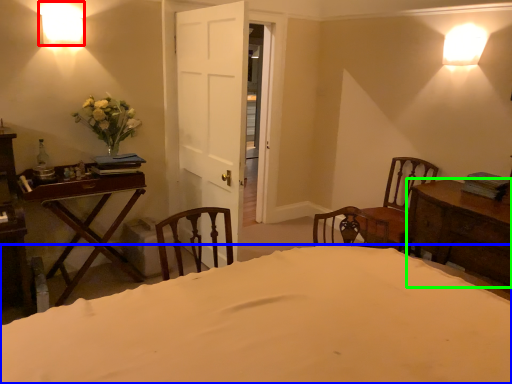
Question: Which object is the closest to the lamp (highlighted by a red box)? Choose among these: bed (highlighted by a blue box) or table (highlighted by a green box).

Choices:
 (A) bed
 (B) table

Answer: (A)